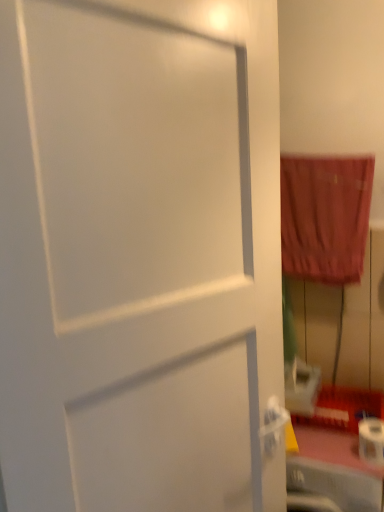
The width and height of the screenshot is (384, 512). Describe the element at coordinates (325, 217) in the screenshot. I see `velvet-like red curtain at right` at that location.

What are the coordinates of `velvet-like red curtain at right` in the screenshot? It's located at (325, 217).

What do you see at coordinates (371, 440) in the screenshot? I see `white matte toilet paper at lower right` at bounding box center [371, 440].

At what (x,y) coordinates should I click in order to perform the action: click on white matte toilet paper at lower right. Please return your answer as a coordinate pair (x, y). The image size is (384, 512). Looking at the image, I should click on (371, 440).

The image size is (384, 512). I want to click on velvet-like red curtain at right, so click(x=325, y=217).

Would you say white matte toilet paper at lower right is to the left or to the right of velvet-like red curtain at right in the picture?

In the image, white matte toilet paper at lower right appears on the right side of velvet-like red curtain at right.

Considering their positions, is white matte toilet paper at lower right located in front of or behind velvet-like red curtain at right?

white matte toilet paper at lower right is in front of velvet-like red curtain at right.

Considering the positions of point (373, 419) and point (335, 208), is point (373, 419) closer or farther from the camera than point (335, 208)?

Clearly, point (373, 419) is closer to the camera than point (335, 208).

From the image's perspective, relative to velvet-like red curtain at right, is white matte toilet paper at lower right above or below?

white matte toilet paper at lower right is situated lower than velvet-like red curtain at right in the image.

From a real-world perspective, is white matte toilet paper at lower right positioned under velvet-like red curtain at right based on gravity?

Correct, in the physical world, white matte toilet paper at lower right is lower than velvet-like red curtain at right.

Considering the sizes of objects white matte toilet paper at lower right and velvet-like red curtain at right in the image provided, who is wider, white matte toilet paper at lower right or velvet-like red curtain at right?

white matte toilet paper at lower right.

Who is shorter, white matte toilet paper at lower right or velvet-like red curtain at right?

Standing shorter between the two is white matte toilet paper at lower right.

Looking at the image, does white matte toilet paper at lower right seem bigger or smaller compared to velvet-like red curtain at right?

Considering their sizes, white matte toilet paper at lower right takes up less space than velvet-like red curtain at right.

Is white matte toilet paper at lower right not within velvet-like red curtain at right?

white matte toilet paper at lower right is positioned outside velvet-like red curtain at right.

Would you say white matte toilet paper at lower right is a long distance from velvet-like red curtain at right?

No, there isn't a large distance between white matte toilet paper at lower right and velvet-like red curtain at right.

Could you tell me if white matte toilet paper at lower right is turned towards velvet-like red curtain at right?

No, white matte toilet paper at lower right is not facing towards velvet-like red curtain at right.

How different are the orientations of white matte toilet paper at lower right and velvet-like red curtain at right in degrees?

The angular difference between white matte toilet paper at lower right and velvet-like red curtain at right is 0.0049 degrees.

This screenshot has height=512, width=384. What are the coordinates of `curtain positioned vertically above the white matte toilet paper at lower right (from a real-world perspective)` in the screenshot? It's located at (325, 217).

Considering the positions of objects velvet-like red curtain at right and white matte toilet paper at lower right in the image provided, who is more to the right, velvet-like red curtain at right or white matte toilet paper at lower right?

From the viewer's perspective, white matte toilet paper at lower right appears more on the right side.

Is the position of velvet-like red curtain at right more distant than that of white matte toilet paper at lower right?

Yes, it is behind white matte toilet paper at lower right.

Which is behind, point (368, 209) or point (374, 457)?

The point (368, 209) is farther from the camera.

From the image's perspective, which is above, velvet-like red curtain at right or white matte toilet paper at lower right?

velvet-like red curtain at right, from the image's perspective.

From a real-world perspective, between velvet-like red curtain at right and white matte toilet paper at lower right, who is vertically higher?

velvet-like red curtain at right, from a real-world perspective.

In terms of width, does velvet-like red curtain at right look wider or thinner when compared to white matte toilet paper at lower right?

velvet-like red curtain at right is thinner than white matte toilet paper at lower right.

Looking at this image, is velvet-like red curtain at right taller than white matte toilet paper at lower right?

Indeed, velvet-like red curtain at right has a greater height compared to white matte toilet paper at lower right.

Does velvet-like red curtain at right have a smaller size compared to white matte toilet paper at lower right?

Actually, velvet-like red curtain at right might be larger than white matte toilet paper at lower right.

From the picture: Is white matte toilet paper at lower right completely or partially inside velvet-like red curtain at right?

No, white matte toilet paper at lower right is not surrounded by velvet-like red curtain at right.

Is velvet-like red curtain at right touching white matte toilet paper at lower right?

No, velvet-like red curtain at right is not touching white matte toilet paper at lower right.

Consider the image. Is white matte toilet paper at lower right at the back of velvet-like red curtain at right?

No.

This screenshot has height=512, width=384. I want to click on curtain located on the left of white matte toilet paper at lower right, so click(x=325, y=217).

In the image, there is a velvet-like red curtain at right. Identify the location of toilet paper below it (from the image's perspective). This screenshot has width=384, height=512. (371, 440).

What are the coordinates of `curtain above the white matte toilet paper at lower right (from the image's perspective)` in the screenshot? It's located at (325, 217).